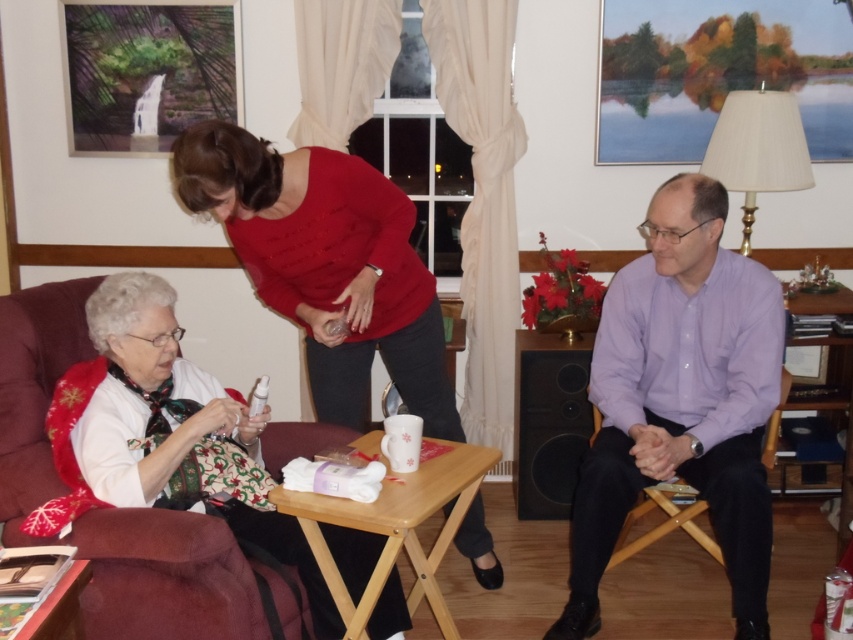
Question: Does purple smooth shirt at center have a smaller size compared to white fabric at left?

Choices:
 (A) yes
 (B) no

Answer: (A)

Question: Which of these objects is positioned closest to the white fabric at left?

Choices:
 (A) matte red sweater at center
 (B) purple smooth shirt at center

Answer: (A)

Question: Which point is closer to the camera?

Choices:
 (A) (395, 212)
 (B) (643, 314)
 (C) (372, 557)

Answer: (C)

Question: Is purple smooth shirt at center in front of matte red sweater at center?

Choices:
 (A) yes
 (B) no

Answer: (B)

Question: Can you confirm if purple smooth shirt at center is positioned to the right of matte red sweater at center?

Choices:
 (A) yes
 (B) no

Answer: (A)

Question: Estimate the real-world distances between objects in this image. Which object is farther from the purple smooth shirt at center?

Choices:
 (A) white fabric at left
 (B) matte red sweater at center

Answer: (A)